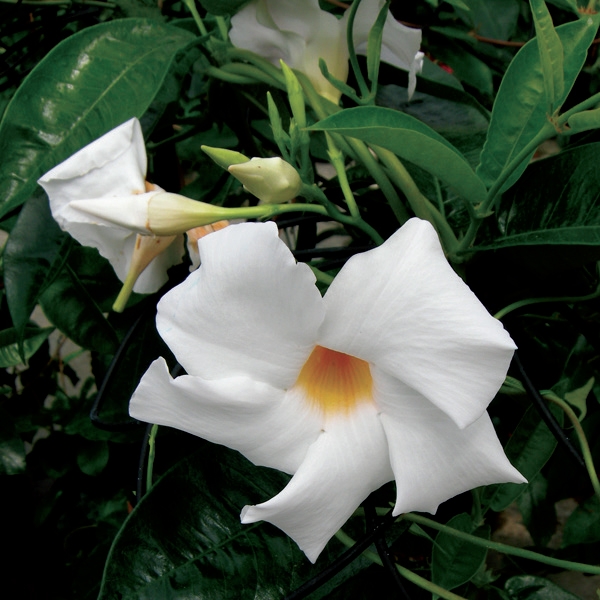
The height and width of the screenshot is (600, 600). I want to click on green plant, so click(411, 137).